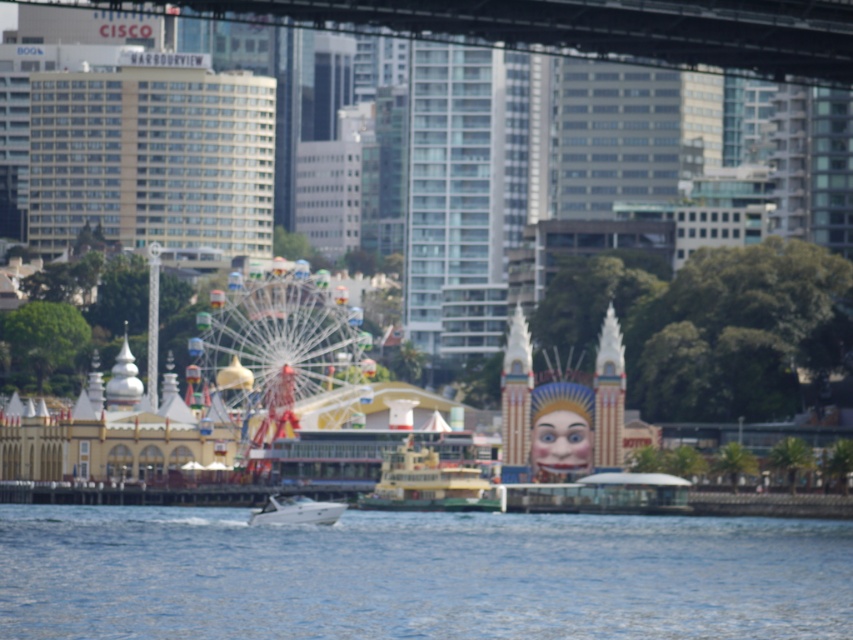
Question: Among these objects, which one is nearest to the camera?

Choices:
 (A) multicolored metallic ferris wheel at center
 (B) dark gray concrete bridge at upper center

Answer: (B)

Question: Is dark gray concrete bridge at upper center above yellow matte ferry at center?

Choices:
 (A) yes
 (B) no

Answer: (A)

Question: Among these objects, which one is farthest from the camera?

Choices:
 (A) white glossy boat at center
 (B) dark gray concrete bridge at upper center

Answer: (B)

Question: Does dark gray concrete bridge at upper center appear under yellow matte ferry at center?

Choices:
 (A) no
 (B) yes

Answer: (A)

Question: Estimate the real-world distances between objects in this image. Which object is closer to the blue water at lower center?

Choices:
 (A) white glossy boat at center
 (B) yellow matte ferry at center

Answer: (B)

Question: Does blue water at lower center have a larger size compared to white glossy boat at center?

Choices:
 (A) yes
 (B) no

Answer: (A)